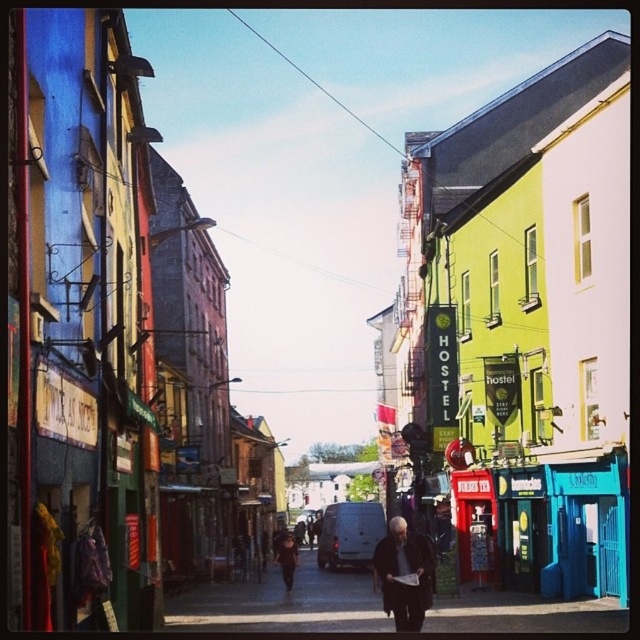
Can you confirm if smooth asphalt road at center is smaller than dark brown leather jacket at center?

Incorrect, smooth asphalt road at center is not smaller in size than dark brown leather jacket at center.

Is smooth asphalt road at center below dark brown leather jacket at center?

Correct, smooth asphalt road at center is located below dark brown leather jacket at center.

Is point (179, 609) closer to camera compared to point (385, 602)?

No.

This screenshot has width=640, height=640. I want to click on smooth asphalt road at center, so click(x=284, y=604).